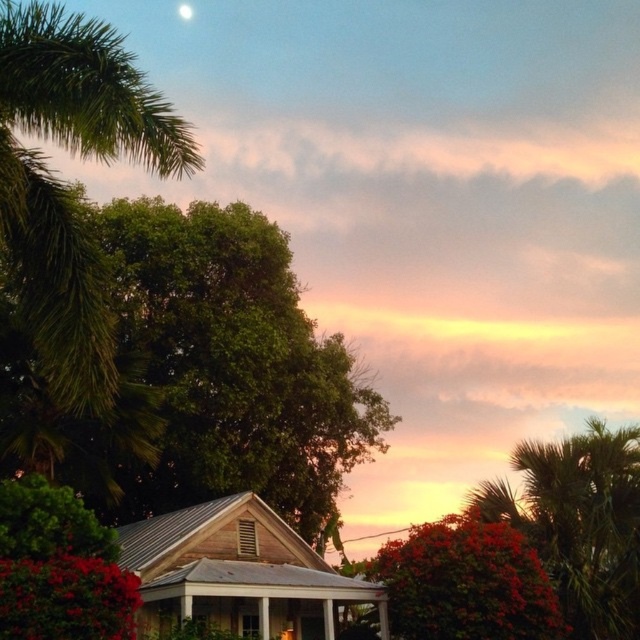
Question: Which of the following is the farthest from the observer?

Choices:
 (A) (184, 12)
 (B) (294, 632)
 (C) (42, 433)
 (D) (113, 365)

Answer: (A)

Question: Is green leafy palm tree at upper left below white glossy moon at upper center?

Choices:
 (A) no
 (B) yes

Answer: (B)

Question: Among these objects, which one is nearest to the camera?

Choices:
 (A) green leafy palm tree at upper left
 (B) green leafy tree at upper left

Answer: (A)

Question: Is green leafy palm tree at upper left wider than wooden gazebo at center?

Choices:
 (A) no
 (B) yes

Answer: (B)

Question: Does green leafy tree at upper left appear on the left side of wooden gazebo at center?

Choices:
 (A) no
 (B) yes

Answer: (B)

Question: Which of the following is the closest to the observer?

Choices:
 (A) (180, 13)
 (B) (204, 612)

Answer: (B)